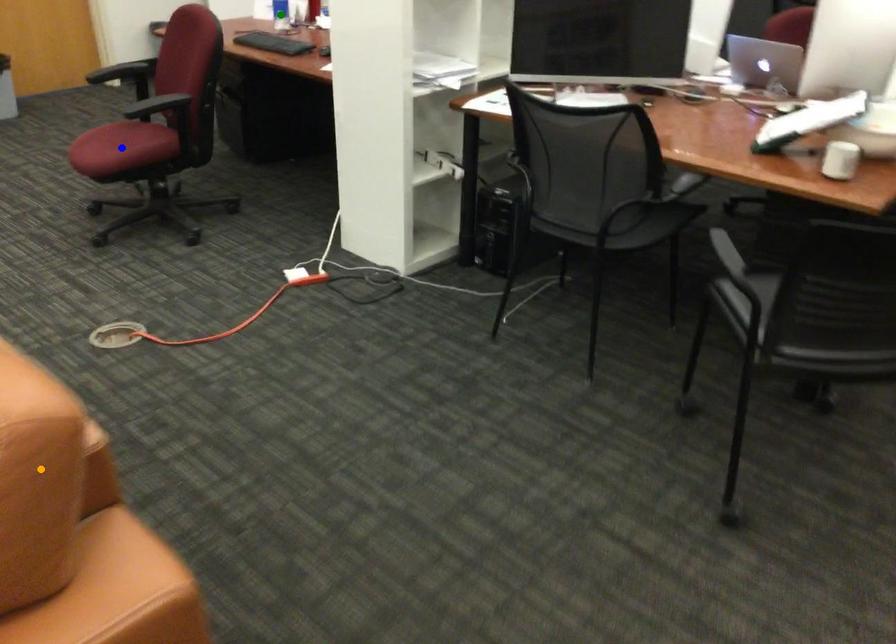
Order these from nearest to farthest:
orange point
blue point
green point

orange point
blue point
green point